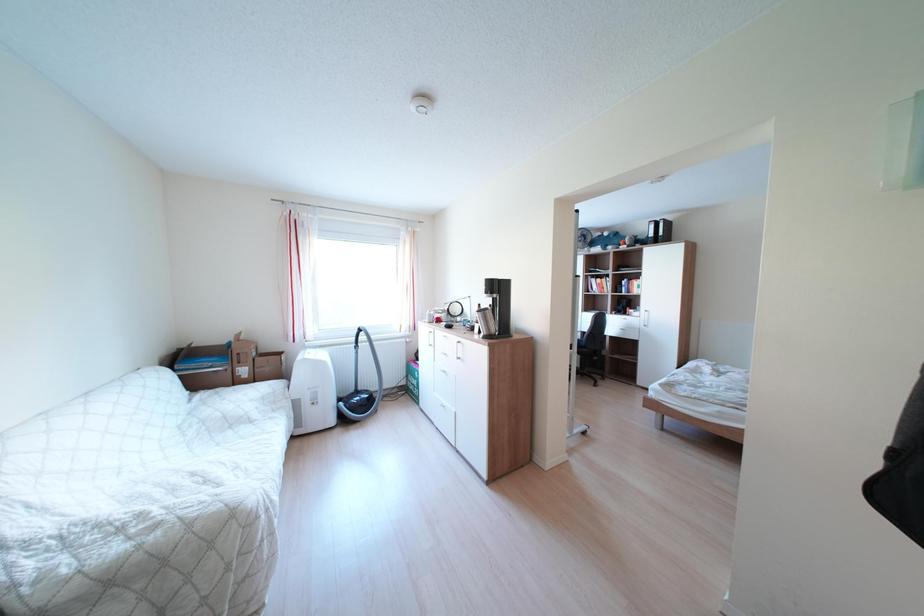
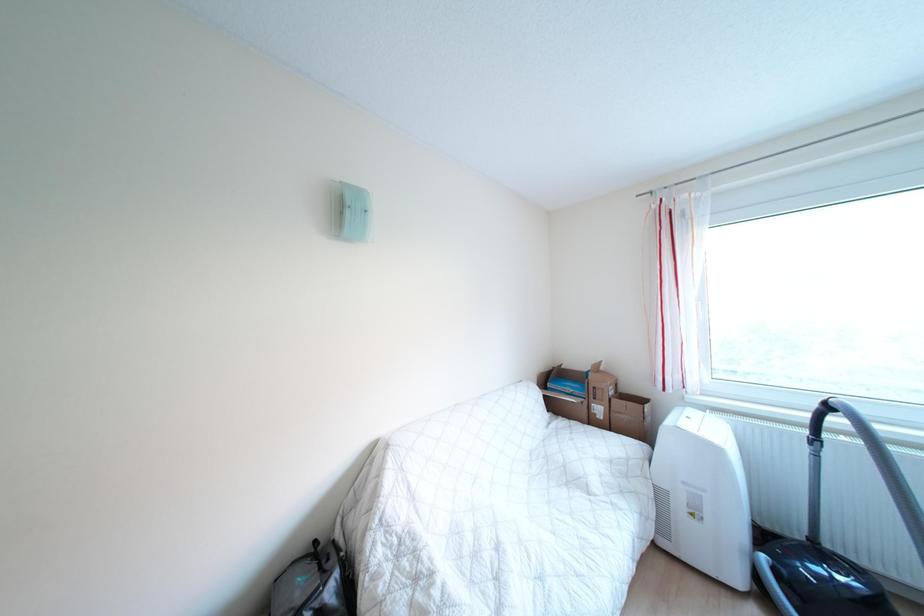
Question: How did the camera likely rotate?

Choices:
 (A) Left
 (B) Right
 (C) Up
 (D) Down

Answer: (A)